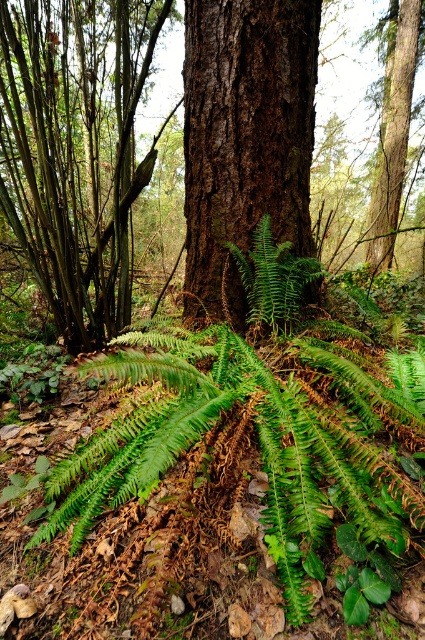
Question: Can you confirm if dark brown bark tree trunk at center is thinner than green matte fern at center?

Choices:
 (A) no
 (B) yes

Answer: (A)

Question: Can you confirm if smooth brown tree trunk at center is positioned above green matte fern at center?

Choices:
 (A) no
 (B) yes

Answer: (B)

Question: Can you confirm if dark brown bark tree trunk at center is wider than smooth brown tree trunk at center?

Choices:
 (A) yes
 (B) no

Answer: (B)

Question: Which of these objects is positioned farthest from the dark brown bark tree trunk at center?

Choices:
 (A) brown rough bark tree at center
 (B) smooth brown tree trunk at center

Answer: (B)

Question: Which point is farther to the camera?

Choices:
 (A) [101, 227]
 (B) [206, 49]
 (C) [235, 371]
 (D) [269, 234]

Answer: (A)

Question: Among these objects, which one is nearest to the camera?

Choices:
 (A) green matte fern at center
 (B) green leafy fern at lower center

Answer: (B)